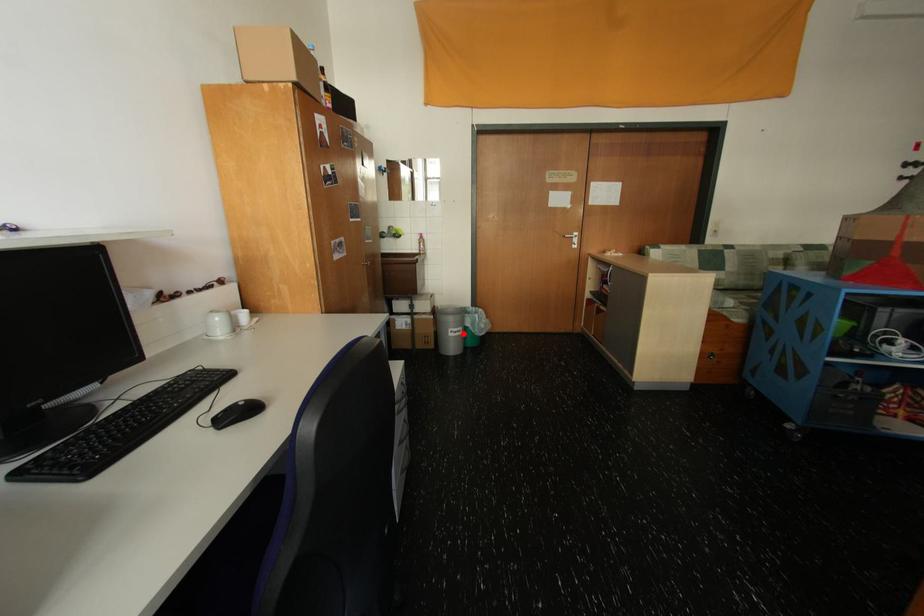
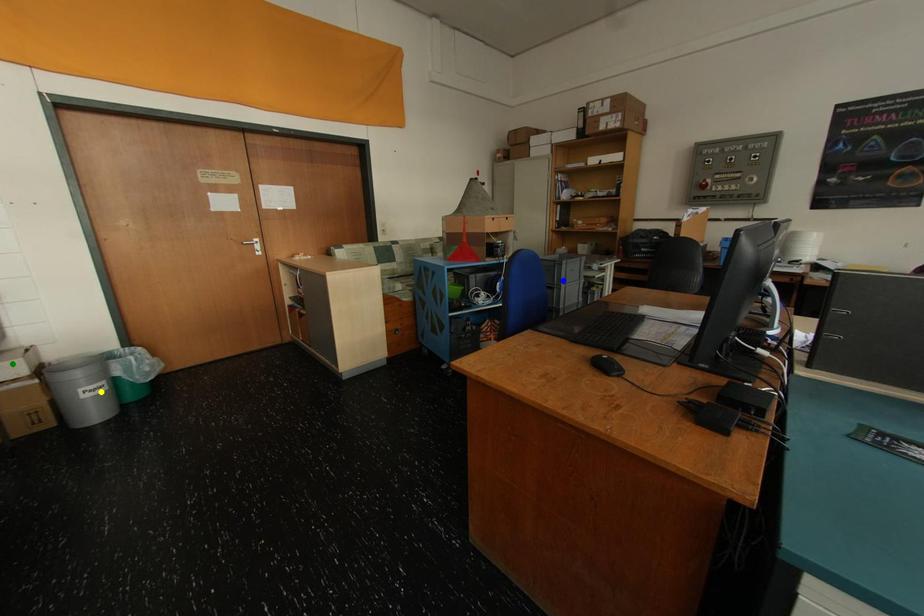
Question: I am providing you with two images of the same scene from different viewpoints. A red point is marked on the first image. You are given multiple points on the second image. Can you choose the point in image 2 that corresponds to the point in image 1?

Choices:
 (A) blue point
 (B) green point
 (C) yellow point

Answer: (C)